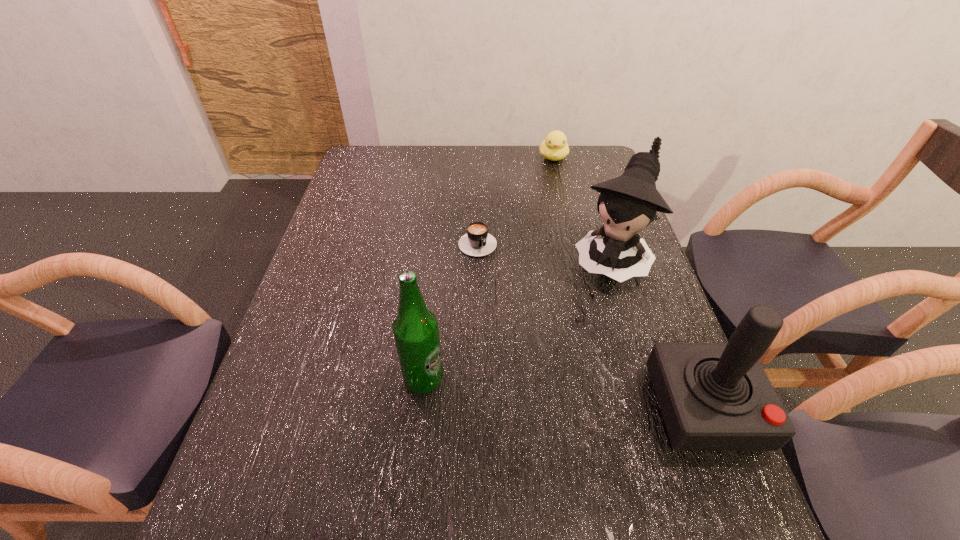
I want to click on duckling positioned at the right edge, so click(x=554, y=147).

Locate an element on the screen. doll at the right edge is located at coordinates (627, 204).

The image size is (960, 540). I want to click on object positioned at the far right corner, so click(x=554, y=147).

In order to click on object situated at the near right corner in this screenshot , I will do `click(713, 396)`.

The width and height of the screenshot is (960, 540). Find the location of `free space at the far edge of the desktop`. free space at the far edge of the desktop is located at coordinates (406, 166).

Identify the location of vacant space at the near edge. (394, 454).

I want to click on free space at the left edge, so click(x=346, y=205).

Where is `vacant region at the right edge`? The height and width of the screenshot is (540, 960). vacant region at the right edge is located at coordinates (597, 201).

The height and width of the screenshot is (540, 960). I want to click on vacant region at the far left corner, so click(391, 160).

Image resolution: width=960 pixels, height=540 pixels. Identify the location of vacant space that is in between the farthest object and the joystick. (629, 282).